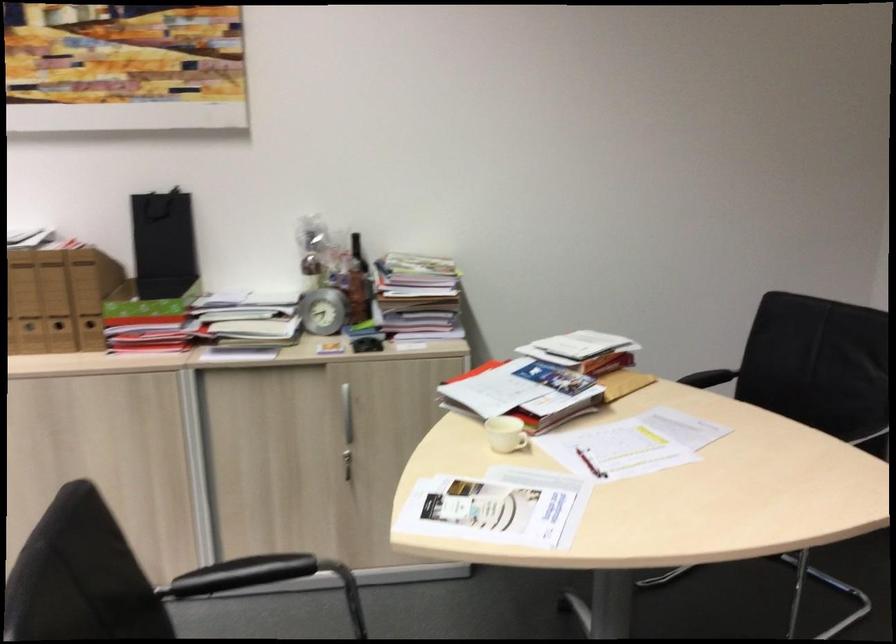
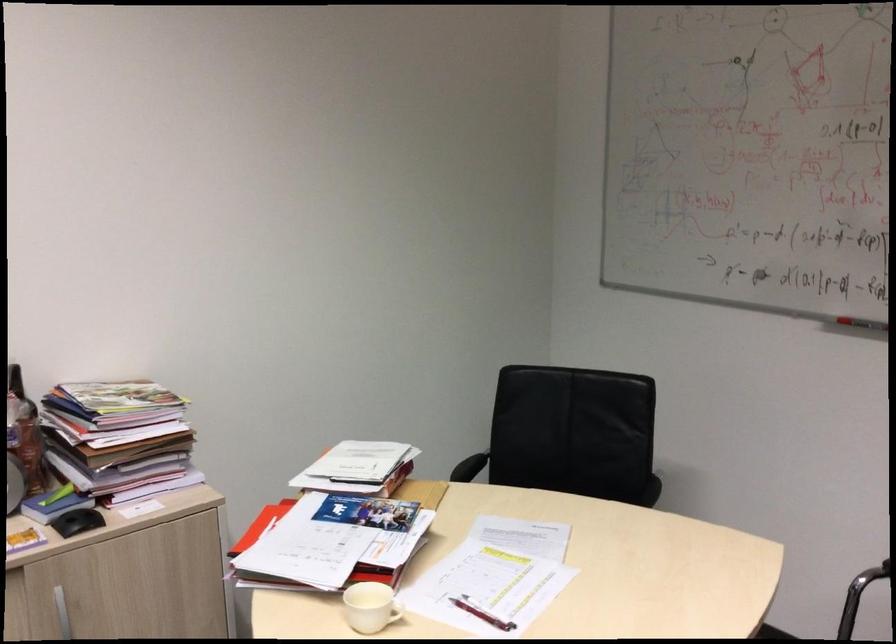
Question: How did the camera likely rotate?

Choices:
 (A) Left
 (B) Right
 (C) Up
 (D) Down

Answer: (B)